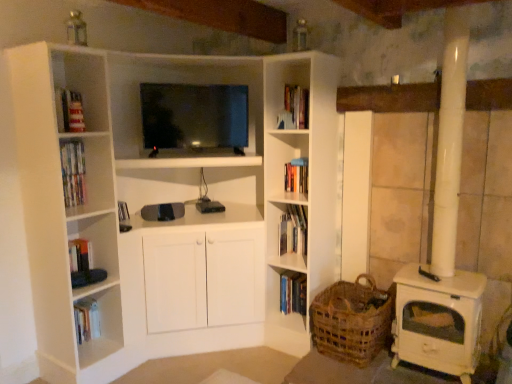
Question: Does matte black tv at center appear on the right side of hardcover book at center, arranged as the first book when viewed from the top?

Choices:
 (A) no
 (B) yes

Answer: (A)

Question: Could you tell me if matte black tv at center is turned towards hardcover book at center, arranged as the first book when viewed from the top?

Choices:
 (A) no
 (B) yes

Answer: (A)

Question: Can you confirm if matte black tv at center is thinner than hardcover book at center, arranged as the first book when viewed from the top?

Choices:
 (A) yes
 (B) no

Answer: (B)

Question: Does matte black tv at center have a lesser height compared to hardcover book at center, which is counted as the 2th book, starting from the bottom?

Choices:
 (A) yes
 (B) no

Answer: (B)

Question: Are matte black tv at center and hardcover book at center, which is counted as the 2th book, starting from the bottom, far apart?

Choices:
 (A) no
 (B) yes

Answer: (A)

Question: In terms of width, does woven brown basket at lower right look wider or thinner when compared to matte black tv at center?

Choices:
 (A) thin
 (B) wide

Answer: (B)

Question: Would you say woven brown basket at lower right is to the left or to the right of matte black tv at center in the picture?

Choices:
 (A) left
 (B) right

Answer: (B)

Question: In terms of size, does woven brown basket at lower right appear bigger or smaller than matte black tv at center?

Choices:
 (A) big
 (B) small

Answer: (B)

Question: Does point click(x=368, y=339) appear closer or farther from the camera than point click(x=176, y=142)?

Choices:
 (A) farther
 (B) closer

Answer: (B)

Question: Is matte black tv at center taller or shorter than hardcover book at center, which is counted as the 2th book, starting from the bottom?

Choices:
 (A) short
 (B) tall

Answer: (B)

Question: Considering their positions, is matte black tv at center located in front of or behind hardcover book at center, arranged as the first book when viewed from the top?

Choices:
 (A) front
 (B) behind

Answer: (A)

Question: Looking at their shapes, would you say matte black tv at center is wider or thinner than hardcover book at center, arranged as the first book when viewed from the top?

Choices:
 (A) thin
 (B) wide

Answer: (B)

Question: Does point (199, 87) appear closer or farther from the camera than point (287, 228)?

Choices:
 (A) farther
 (B) closer

Answer: (B)

Question: Considering the positions of woven brown basket at lower right and hardcover book at center, which is the first book in bottom-to-top order, in the image, is woven brown basket at lower right taller or shorter than hardcover book at center, which is the first book in bottom-to-top order,?

Choices:
 (A) tall
 (B) short

Answer: (A)

Question: In terms of width, does woven brown basket at lower right look wider or thinner when compared to hardcover book at center, which is the first book in bottom-to-top order?

Choices:
 (A) thin
 (B) wide

Answer: (B)